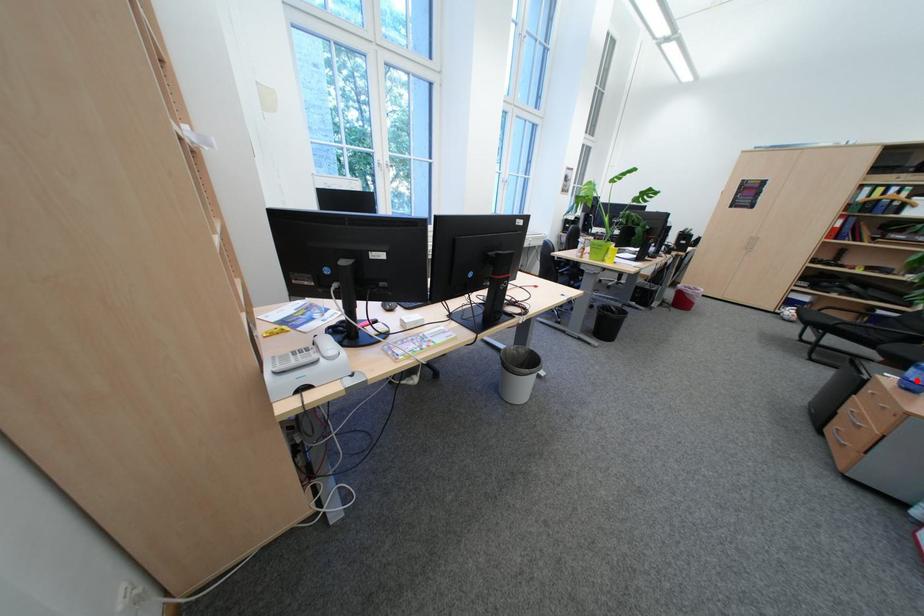
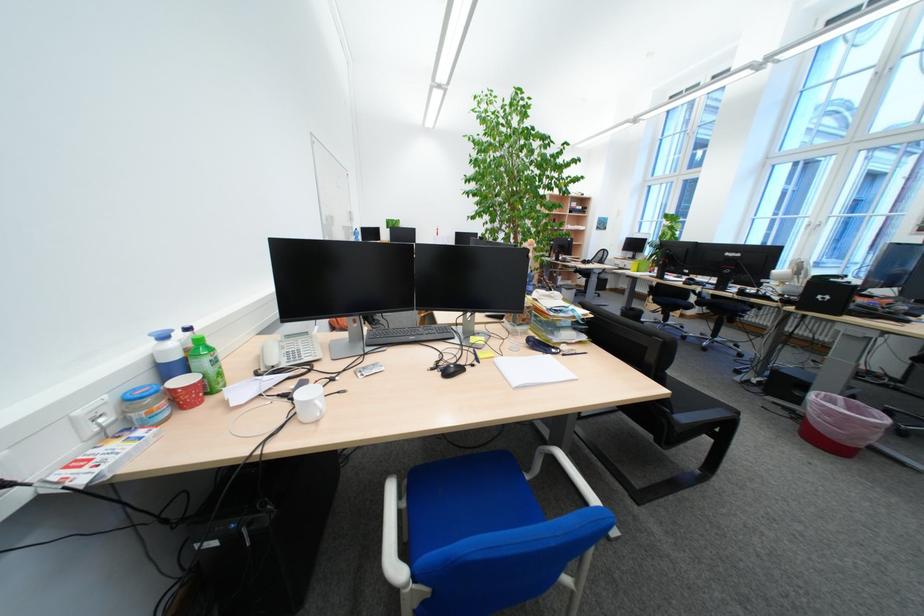
Question: I am providing you with two images of the same scene from different viewpoints. A red point is marked on the first image. At the location where the point appears in image 1, is it still visible in image 2?

Choices:
 (A) Yes
 (B) No

Answer: (B)